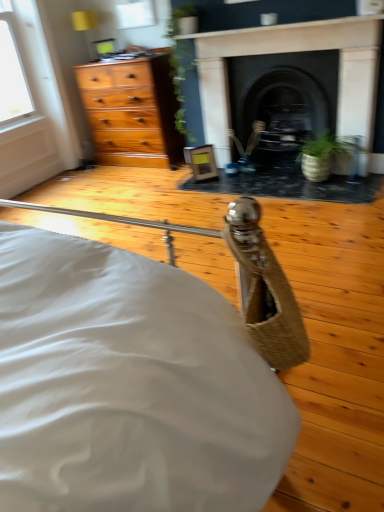
Measure the distance between point (260, 50) and camera.

Point (260, 50) is 10.56 feet from camera.

Based on the photo, what is the approximate height of transparent glass window at upper center?

transparent glass window at upper center is 28.32 centimeters tall.

In order to face transparent glass window at upper center, should I rotate leftwards or rightwards?

Rotate your view left by about 7.881°.

Where is `green textured pot at center`? green textured pot at center is located at coordinates (321, 155).

From the image's perspective, is black stone fireplace at center, which is the second fireplace in left-to-right order, under green textured pot at center?

No, from the image's perspective, black stone fireplace at center, which is the second fireplace in left-to-right order, is not beneath green textured pot at center.

Find the location of a particular element. The height and width of the screenshot is (512, 384). houseplant below the black stone fireplace at center, which is the second fireplace in left-to-right order (from the image's perspective) is located at coordinates (321, 155).

Is black stone fireplace at center, which is the second fireplace in left-to-right order, wider than green textured pot at center?

No.

Is black stone fireplace at center, which appears as the first fireplace when viewed from the right, far from green textured pot at center?

That's not correct — black stone fireplace at center, which appears as the first fireplace when viewed from the right, is a little close to green textured pot at center.

Looking at this image, from the image's perspective, which one is positioned lower, dark stone fireplace at center, the 2th fireplace positioned from the right, or transparent glass window at upper center?

From the image's view, dark stone fireplace at center, the 2th fireplace positioned from the right, is below.

Would you consider dark stone fireplace at center, marked as the first fireplace in a left-to-right arrangement, to be distant from transparent glass window at upper center?

Yes, dark stone fireplace at center, marked as the first fireplace in a left-to-right arrangement, and transparent glass window at upper center are quite far apart.

Is dark stone fireplace at center, marked as the first fireplace in a left-to-right arrangement, oriented towards transparent glass window at upper center?

No, dark stone fireplace at center, marked as the first fireplace in a left-to-right arrangement, is not turned towards transparent glass window at upper center.

Which fireplace is the 1st one when counting from the right side of the transparent glass window at upper center? Please provide its 2D coordinates.

[(294, 52)]

Would you say black stone fireplace at center, which appears as the first fireplace when viewed from the right, is part of dark stone fireplace at center, the 2th fireplace positioned from the right,'s contents?

Definitely not — black stone fireplace at center, which appears as the first fireplace when viewed from the right, is not inside dark stone fireplace at center, the 2th fireplace positioned from the right.

From a real-world perspective, which object rests below the other?

From a 3D spatial view, black stone fireplace at center, which appears as the first fireplace when viewed from the right, is below.

Does dark stone fireplace at center, marked as the first fireplace in a left-to-right arrangement, appear on the right side of black stone fireplace at center, which appears as the first fireplace when viewed from the right?

Incorrect, dark stone fireplace at center, marked as the first fireplace in a left-to-right arrangement, is not on the right side of black stone fireplace at center, which appears as the first fireplace when viewed from the right.

Can you confirm if transparent glass window at upper center is smaller than black stone fireplace at center, which is the second fireplace in left-to-right order?

Yes.

Relative to black stone fireplace at center, which is the second fireplace in left-to-right order, is transparent glass window at upper center in front or behind?

Clearly, transparent glass window at upper center is behind black stone fireplace at center, which is the second fireplace in left-to-right order.

How many degrees apart are the facing directions of transparent glass window at upper center and black stone fireplace at center, which is the second fireplace in left-to-right order?

transparent glass window at upper center and black stone fireplace at center, which is the second fireplace in left-to-right order, are facing 0.11 degrees away from each other.

Which object is positioned more to the left, transparent glass window at upper center or black stone fireplace at center, which is the second fireplace in left-to-right order?

Positioned to the left is transparent glass window at upper center.

Does point (310, 163) lie in front of point (212, 59)?

Yes, point (310, 163) is in front of point (212, 59).

Is green textured pot at center located outside dark stone fireplace at center, the 2th fireplace positioned from the right?

Yes, green textured pot at center is located beyond the bounds of dark stone fireplace at center, the 2th fireplace positioned from the right.

In the scene shown: Is green textured pot at center wider than dark stone fireplace at center, marked as the first fireplace in a left-to-right arrangement?

Yes.

Is dark stone fireplace at center, the 2th fireplace positioned from the right, surrounded by transparent glass window at upper center?

Definitely not — dark stone fireplace at center, the 2th fireplace positioned from the right, is not inside transparent glass window at upper center.

How much distance is there between transparent glass window at upper center and dark stone fireplace at center, the 2th fireplace positioned from the right?

transparent glass window at upper center is 4.81 feet away from dark stone fireplace at center, the 2th fireplace positioned from the right.

Between transparent glass window at upper center and dark stone fireplace at center, the 2th fireplace positioned from the right, which one has smaller width?

transparent glass window at upper center.

From a real-world perspective, is transparent glass window at upper center on top of dark stone fireplace at center, the 2th fireplace positioned from the right?

Yes, from a real-world perspective, transparent glass window at upper center is over dark stone fireplace at center, the 2th fireplace positioned from the right

Which object is positioned more to the right, green textured pot at center or transparent glass window at upper center?

green textured pot at center.

Is green textured pot at center aimed at transparent glass window at upper center?

No, green textured pot at center is not oriented towards transparent glass window at upper center.

Considering the positions of points (333, 137) and (136, 16), is point (333, 137) closer to camera compared to point (136, 16)?

Yes, it is in front of point (136, 16).

From a real-world perspective, between green textured pot at center and transparent glass window at upper center, who is vertically lower?

green textured pot at center.

Image resolution: width=384 pixels, height=512 pixels. I want to click on the 1st fireplace above the green textured pot at center (from a real-world perspective), so click(284, 90).

From the transparent glass window at upper center, count 2nd fireplaces forward and point to it. Please provide its 2D coordinates.

[(294, 52)]

Consider the image. Which object lies nearer to the anchor point dark stone fireplace at center, the 2th fireplace positioned from the right, black stone fireplace at center, which appears as the first fireplace when viewed from the right, or transparent glass window at upper center?

black stone fireplace at center, which appears as the first fireplace when viewed from the right, is closer to dark stone fireplace at center, the 2th fireplace positioned from the right.

When comparing their distances from transparent glass window at upper center, does green textured pot at center or dark stone fireplace at center, marked as the first fireplace in a left-to-right arrangement, seem further?

green textured pot at center is further to transparent glass window at upper center.

When comparing their distances from transparent glass window at upper center, does green textured pot at center or black stone fireplace at center, which appears as the first fireplace when viewed from the right, seem further?

green textured pot at center lies further to transparent glass window at upper center than the other object.

Estimate the real-world distances between objects in this image. Which object is further from dark stone fireplace at center, marked as the first fireplace in a left-to-right arrangement, transparent glass window at upper center or black stone fireplace at center, which appears as the first fireplace when viewed from the right?

transparent glass window at upper center is further to dark stone fireplace at center, marked as the first fireplace in a left-to-right arrangement.

Estimate the real-world distances between objects in this image. Which object is closer to black stone fireplace at center, which is the second fireplace in left-to-right order, dark stone fireplace at center, marked as the first fireplace in a left-to-right arrangement, or transparent glass window at upper center?

dark stone fireplace at center, marked as the first fireplace in a left-to-right arrangement, lies closer to black stone fireplace at center, which is the second fireplace in left-to-right order, than the other object.

Which object lies nearer to the anchor point dark stone fireplace at center, marked as the first fireplace in a left-to-right arrangement, green textured pot at center or black stone fireplace at center, which appears as the first fireplace when viewed from the right?

black stone fireplace at center, which appears as the first fireplace when viewed from the right, is positioned closer to the anchor dark stone fireplace at center, marked as the first fireplace in a left-to-right arrangement.

In the scene shown: When comparing their distances from green textured pot at center, does dark stone fireplace at center, the 2th fireplace positioned from the right, or transparent glass window at upper center seem closer?

dark stone fireplace at center, the 2th fireplace positioned from the right, is closer to green textured pot at center.

When comparing their distances from green textured pot at center, does transparent glass window at upper center or black stone fireplace at center, which appears as the first fireplace when viewed from the right, seem closer?

Among the two, black stone fireplace at center, which appears as the first fireplace when viewed from the right, is located nearer to green textured pot at center.

The image size is (384, 512). I want to click on fireplace between transparent glass window at upper center and black stone fireplace at center, which appears as the first fireplace when viewed from the right, in the horizontal direction, so click(294, 52).

Locate an element on the screen. fireplace that lies between black stone fireplace at center, which is the second fireplace in left-to-right order, and green textured pot at center from top to bottom is located at coordinates point(294,52).